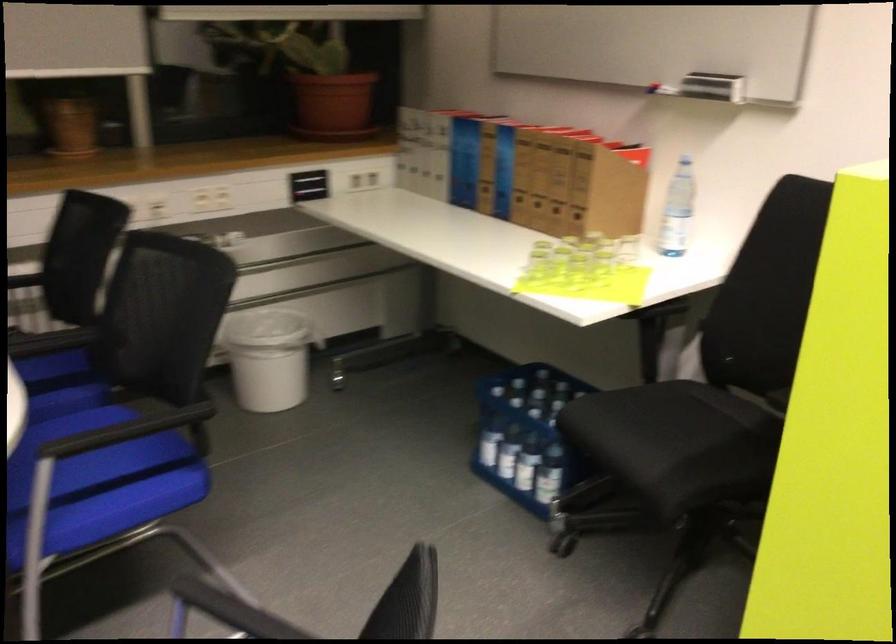
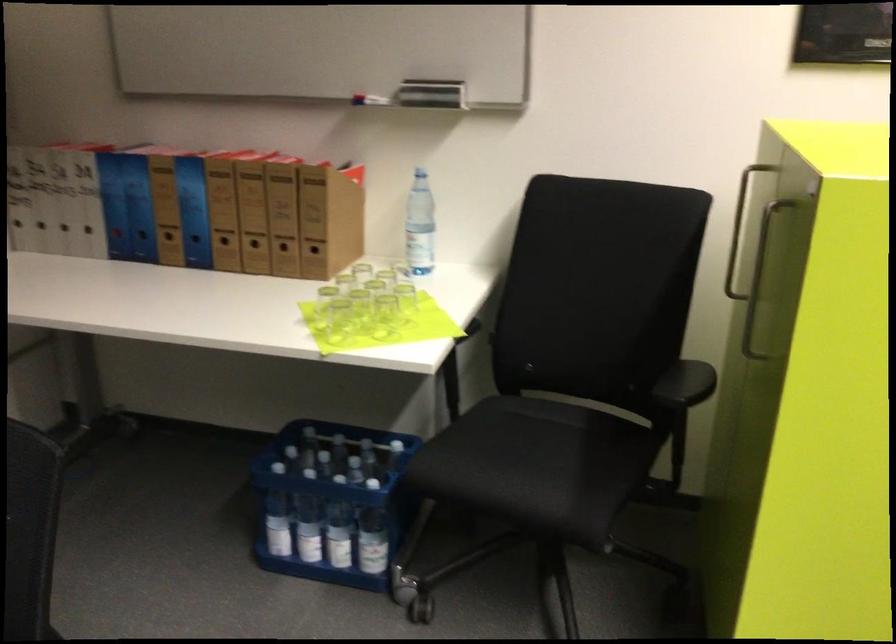
The point at (624, 269) is marked in the first image. Where is the corresponding point in the second image?

(405, 299)